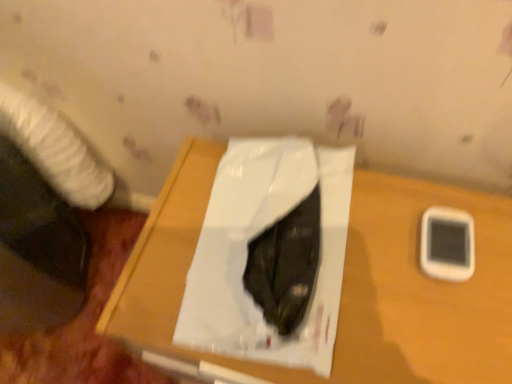
What is the approximate width of wooden table at center?

wooden table at center is 42.31 centimeters in width.

The width and height of the screenshot is (512, 384). What are the coordinates of `white glossy paper at center` in the screenshot? It's located at (270, 254).

In terms of height, does wooden table at center look taller or shorter compared to white plastic mobile phone at right?

Considering their sizes, wooden table at center has more height than white plastic mobile phone at right.

Is white plastic mobile phone at right at the back of wooden table at center?

wooden table at center does not have its back to white plastic mobile phone at right.

From a real-world perspective, is wooden table at center under white plastic mobile phone at right?

Yes, from a real-world perspective, wooden table at center is under white plastic mobile phone at right.

From the image's perspective, which one is positioned higher, wooden table at center or white plastic mobile phone at right?

white plastic mobile phone at right, from the image's perspective.

Considering the positions of points (310, 164) and (408, 223), is point (310, 164) farther from camera compared to point (408, 223)?

Yes, it is.

Could you tell me if white glossy paper at center is facing wooden table at center?

No, white glossy paper at center is not facing towards wooden table at center.

In the scene shown: Is white glossy paper at center surrounding wooden table at center?

Definitely not — wooden table at center is not inside white glossy paper at center.

Consider the image. Is white glossy paper at center directly adjacent to wooden table at center?

Yes, white glossy paper at center is right next to wooden table at center and making contact.

Can you confirm if white glossy paper at center is wider than white plastic mobile phone at right?

Yes.

Considering the positions of points (255, 295) and (420, 264), is point (255, 295) farther from camera compared to point (420, 264)?

No, (255, 295) is closer to viewer.

Is white glossy paper at center at the left side of white plastic mobile phone at right?

Correct, you'll find white glossy paper at center to the left of white plastic mobile phone at right.

From the image's perspective, between white glossy paper at center and white plastic mobile phone at right, who is located below?

white plastic mobile phone at right appears lower in the image.

Is wooden table at center far away from white glossy paper at center?

wooden table at center is actually quite close to white glossy paper at center.

Is wooden table at center at the left side of white glossy paper at center?

No.

Considering their positions, is wooden table at center located in front of or behind white glossy paper at center?

wooden table at center is in front of white glossy paper at center.

Is white plastic mobile phone at right to the left of wooden table at center from the viewer's perspective?

In fact, white plastic mobile phone at right is to the right of wooden table at center.

From a real-world perspective, does white plastic mobile phone at right sit lower than wooden table at center?

Actually, white plastic mobile phone at right is physically above wooden table at center in the real world.

Is white plastic mobile phone at right far away from wooden table at center?

No, white plastic mobile phone at right is in close proximity to wooden table at center.

From the image's perspective, would you say white plastic mobile phone at right is positioned over white glossy paper at center?

No, from the image's perspective, white plastic mobile phone at right is not above white glossy paper at center.

Based on the photo, in the image, is white plastic mobile phone at right on the left side or the right side of white glossy paper at center?

Clearly, white plastic mobile phone at right is on the right of white glossy paper at center in the image.

Considering the relative sizes of white plastic mobile phone at right and white glossy paper at center in the image provided, is white plastic mobile phone at right shorter than white glossy paper at center?

Yes.

Can you tell me how much white plastic mobile phone at right and white glossy paper at center differ in facing direction?

They differ by 3.37 degrees in their facing directions.

Find the location of a particular element. Image resolution: width=512 pixels, height=384 pixels. table in front of the white plastic mobile phone at right is located at coordinates (343, 283).

The height and width of the screenshot is (384, 512). I want to click on table below the white glossy paper at center (from a real-world perspective), so click(x=343, y=283).

Which object lies further to the anchor point white glossy paper at center, white plastic mobile phone at right or wooden table at center?

white plastic mobile phone at right.

In the scene shown: Considering their positions, is wooden table at center positioned closer to white plastic mobile phone at right than white glossy paper at center?

Based on the image, wooden table at center appears to be nearer to white plastic mobile phone at right.

Considering their positions, is wooden table at center positioned further to white glossy paper at center than white plastic mobile phone at right?

white plastic mobile phone at right.

From the image, which object appears to be nearer to wooden table at center, white glossy paper at center or white plastic mobile phone at right?

white glossy paper at center.

When comparing their distances from white plastic mobile phone at right, does white glossy paper at center or wooden table at center seem closer?

Based on the image, wooden table at center appears to be nearer to white plastic mobile phone at right.

Which object lies nearer to the anchor point wooden table at center, white plastic mobile phone at right or white glossy paper at center?

Among the two, white glossy paper at center is located nearer to wooden table at center.

Find the location of a particular element. table between white glossy paper at center and white plastic mobile phone at right in the horizontal direction is located at coordinates (343, 283).